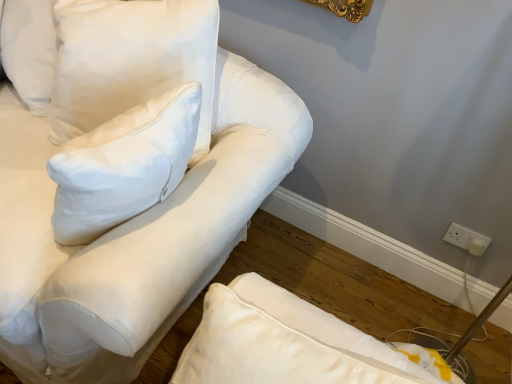
Question: Can you confirm if white plastic socket at lower right is positioned to the right of white cotton pillow at upper left, the first pillow when ordered from left to right?

Choices:
 (A) yes
 (B) no

Answer: (A)

Question: Is the surface of white plastic socket at lower right in direct contact with white cotton pillow at upper left, which appears as the 2th pillow when viewed from the right?

Choices:
 (A) yes
 (B) no

Answer: (B)

Question: Does white plastic socket at lower right have a greater height compared to white cotton pillow at upper left, the first pillow when ordered from left to right?

Choices:
 (A) yes
 (B) no

Answer: (B)

Question: Is white plastic socket at lower right wider than white cotton pillow at upper left, which appears as the 2th pillow when viewed from the right?

Choices:
 (A) yes
 (B) no

Answer: (B)

Question: Is white plastic socket at lower right aimed at white cotton pillow at upper left, which appears as the 2th pillow when viewed from the right?

Choices:
 (A) no
 (B) yes

Answer: (A)

Question: Considering the relative positions of white cotton pillow at upper left, the 2th pillow from the left, and white plastic socket at lower right in the image provided, is white cotton pillow at upper left, the 2th pillow from the left, to the left or to the right of white plastic socket at lower right?

Choices:
 (A) left
 (B) right

Answer: (A)

Question: From a real-world perspective, is white cotton pillow at upper left, the first pillow positioned from the right, above or below white plastic socket at lower right?

Choices:
 (A) above
 (B) below

Answer: (A)

Question: From their relative heights in the image, would you say white cotton pillow at upper left, the 2th pillow from the left, is taller or shorter than white plastic socket at lower right?

Choices:
 (A) short
 (B) tall

Answer: (B)

Question: Looking at their shapes, would you say white cotton pillow at upper left, the first pillow positioned from the right, is wider or thinner than white plastic socket at lower right?

Choices:
 (A) thin
 (B) wide

Answer: (B)

Question: Is point click(x=81, y=365) closer or farther from the camera than point click(x=456, y=228)?

Choices:
 (A) farther
 (B) closer

Answer: (B)

Question: Based on their positions, is white cotton sofa at upper left located to the left or right of white plastic socket at lower right?

Choices:
 (A) left
 (B) right

Answer: (A)

Question: From a real-world perspective, is white cotton sofa at upper left physically located above or below white plastic socket at lower right?

Choices:
 (A) below
 (B) above

Answer: (B)

Question: Considering their positions, is white cotton sofa at upper left located in front of or behind white plastic socket at lower right?

Choices:
 (A) front
 (B) behind

Answer: (A)

Question: Considering the positions of white plastic socket at lower right and white cotton pillow at upper left, the first pillow positioned from the right, in the image, is white plastic socket at lower right bigger or smaller than white cotton pillow at upper left, the first pillow positioned from the right,?

Choices:
 (A) small
 (B) big

Answer: (A)

Question: From a real-world perspective, is white plastic socket at lower right positioned above or below white cotton pillow at upper left, the first pillow positioned from the right?

Choices:
 (A) below
 (B) above

Answer: (A)